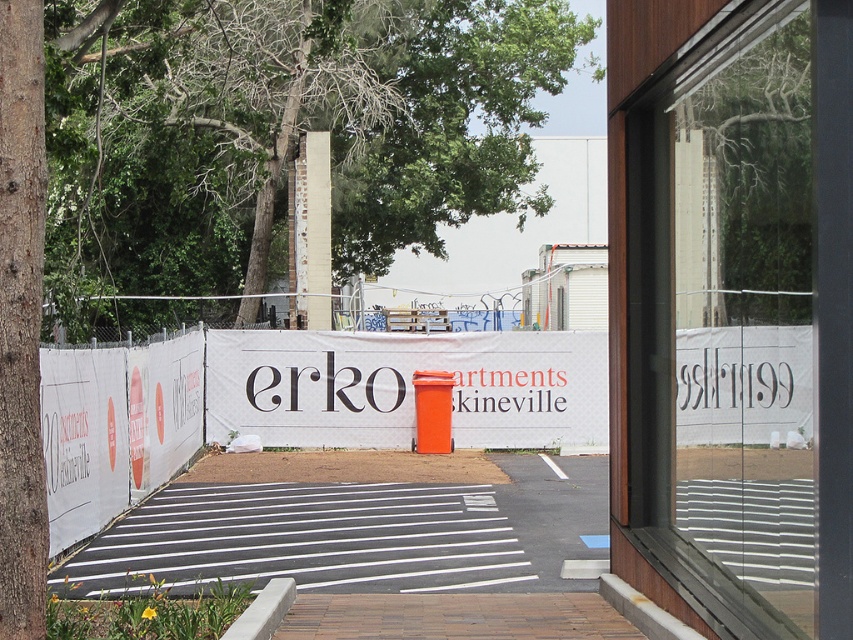
Is transparent glass window at center further to camera compared to white fabric banner at center?

No, transparent glass window at center is closer to the viewer.

Is transparent glass window at center thinner than white fabric banner at center?

Indeed, transparent glass window at center has a lesser width compared to white fabric banner at center.

Locate an element on the screen. The width and height of the screenshot is (853, 640). transparent glass window at center is located at coordinates (732, 310).

Where is `transparent glass window at center`? transparent glass window at center is located at coordinates coord(732,310).

Locate an element on the screen. transparent glass window at center is located at coordinates (732, 310).

Is transparent glass window at center taller than green leafy tree at upper left?

No.

This screenshot has width=853, height=640. I want to click on transparent glass window at center, so click(x=732, y=310).

Between point (154, 164) and point (126, 406), which one is positioned in front?

Point (126, 406) is more forward.

Who is more distant from viewer, (x=146, y=182) or (x=49, y=525)?

The point (x=146, y=182) is more distant.

The image size is (853, 640). Find the location of `green leafy tree at upper left`. green leafy tree at upper left is located at coordinates (280, 132).